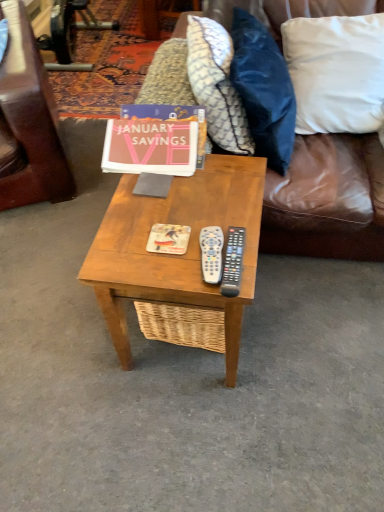
I want to click on free space in front of woodenwoodencoffee table at center, so point(205,436).